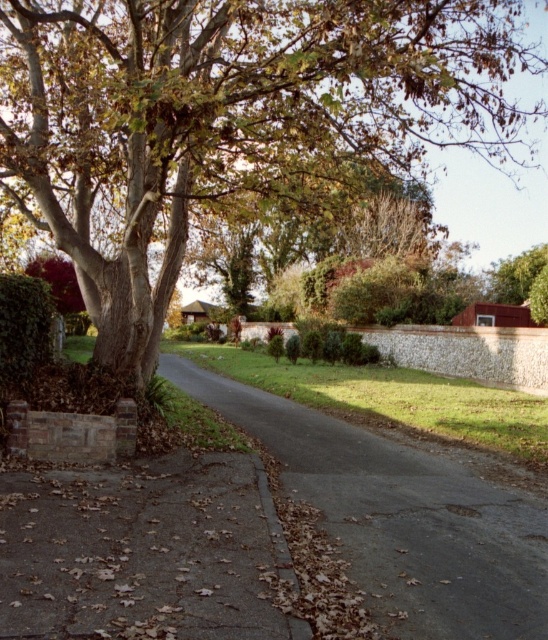
Question: Which object is positioned farthest from the brown textured tree at upper left?

Choices:
 (A) gray concrete driveway at lower left
 (B) dark gray asphalt driveway at center

Answer: (A)

Question: Which point appears closest to the camera in this image?

Choices:
 (A) (486, 67)
 (B) (289, 481)

Answer: (B)

Question: Can you confirm if brown textured tree at upper left is thinner than gray concrete driveway at lower left?

Choices:
 (A) no
 (B) yes

Answer: (A)

Question: Considering the relative positions of gray concrete driveway at lower left and dark gray asphalt driveway at center in the image provided, where is gray concrete driveway at lower left located with respect to dark gray asphalt driveway at center?

Choices:
 (A) left
 (B) right

Answer: (A)

Question: Does brown textured tree at upper left appear under gray concrete driveway at lower left?

Choices:
 (A) yes
 (B) no

Answer: (B)

Question: Which point appears farthest from the camera in this image?

Choices:
 (A) (398, 170)
 (B) (227, 522)

Answer: (A)